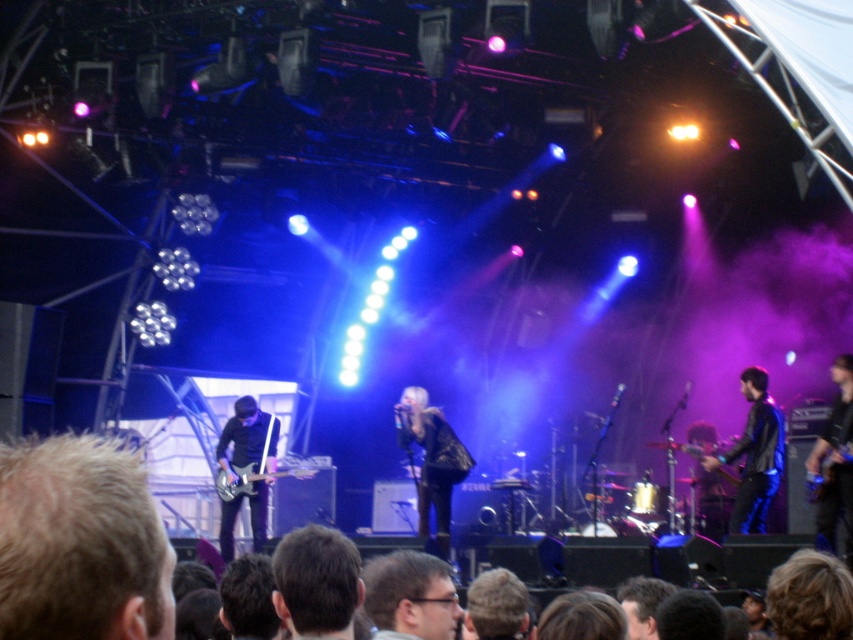
Can you confirm if matte black glasses at lower center is positioned above metallic electric guitar at left?

Indeed, matte black glasses at lower center is positioned over metallic electric guitar at left.

Is matte black glasses at lower center to the left of metallic electric guitar at left from the viewer's perspective?

In fact, matte black glasses at lower center is to the right of metallic electric guitar at left.

Which is behind, point (404, 604) or point (297, 467)?

Point (297, 467)

At what (x,y) coordinates should I click in order to perform the action: click on matte black glasses at lower center. Please return your answer as a coordinate pair (x, y). Image resolution: width=853 pixels, height=640 pixels. Looking at the image, I should click on (410, 596).

The height and width of the screenshot is (640, 853). What are the coordinates of `black leather jacket at right` in the screenshot? It's located at (753, 454).

Can you confirm if black leather jacket at right is positioned above metallic electric guitar at left?

Indeed, black leather jacket at right is positioned over metallic electric guitar at left.

Which is behind, point (782, 436) or point (216, 481)?

The point (216, 481) is behind.

Where is `black leather jacket at right`? This screenshot has width=853, height=640. black leather jacket at right is located at coordinates (753, 454).

Does black leather jacket at right have a greater width compared to shiny black jacket at center?

In fact, black leather jacket at right might be narrower than shiny black jacket at center.

Who is more distant from viewer, (775, 424) or (440, 422)?

Point (440, 422)

Is point (756, 486) more distant than point (403, 419)?

No, it is not.

Find the location of a particular element. black leather jacket at right is located at coordinates (753, 454).